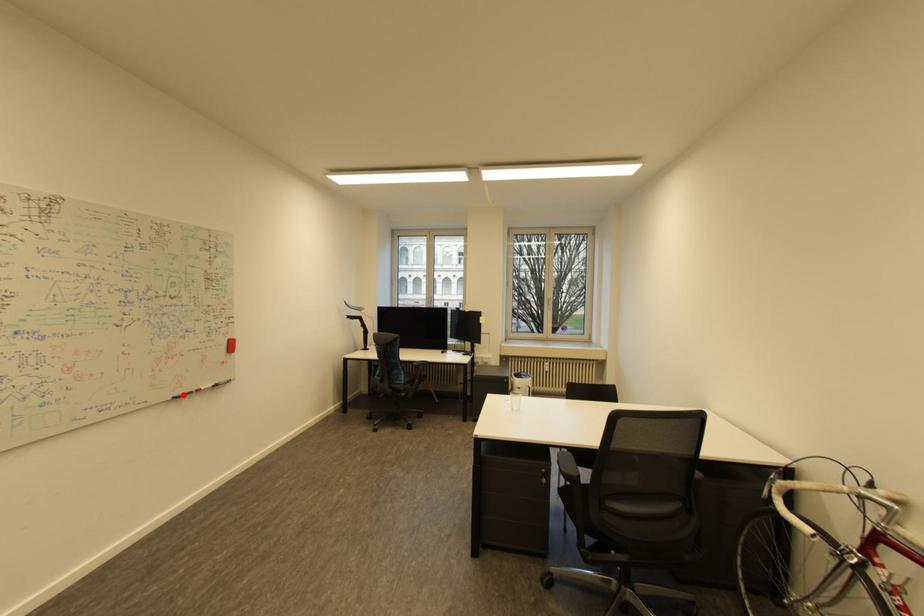
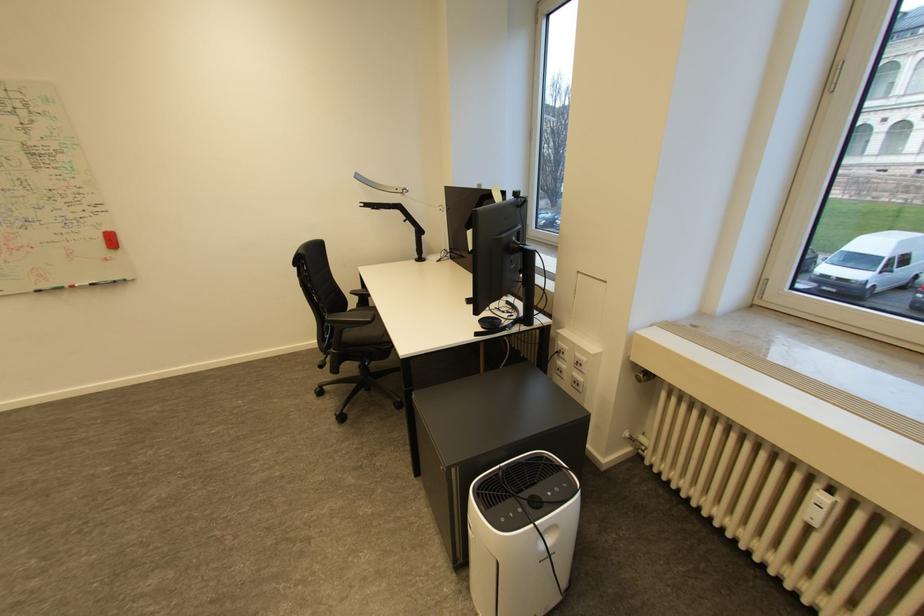
Question: A red point is marked in image1. In image2, is the corresponding 3D point closer to the camera or farther? Reply with the corresponding letter.

Choices:
 (A) The corresponding 3D point is closer.
 (B) The corresponding 3D point is farther.

Answer: (B)